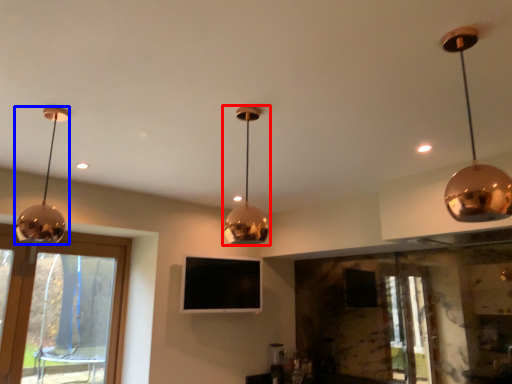
Question: Which point is further to the camera, lamp (highlighted by a red box) or lamp (highlighted by a blue box)?

Choices:
 (A) lamp
 (B) lamp

Answer: (B)